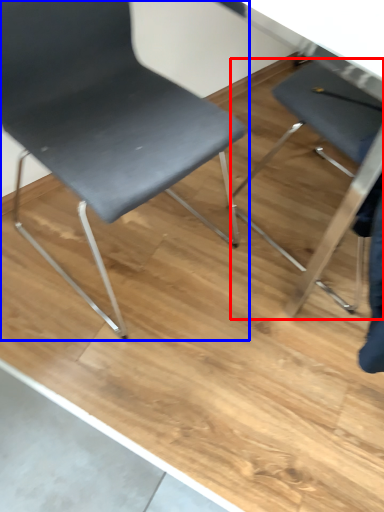
Question: Which object appears closest to the camera in this image, chair (highlighted by a red box) or chair (highlighted by a blue box)?

Choices:
 (A) chair
 (B) chair

Answer: (B)